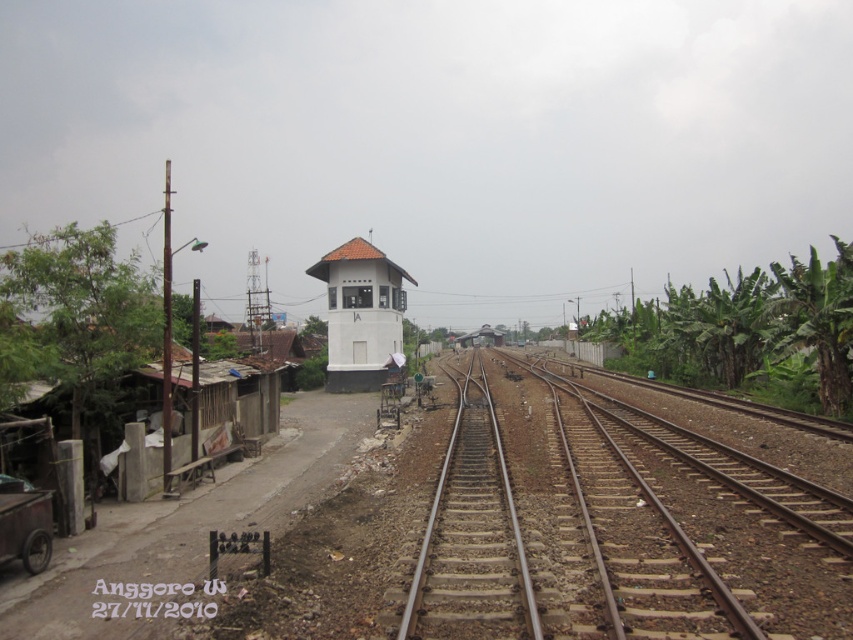
Question: From the image, what is the correct spatial relationship of white matte water tower at center in relation to metallic silver train at center?

Choices:
 (A) below
 (B) above

Answer: (B)

Question: Is brown metal train track at center closer to the viewer compared to white matte water tower at center?

Choices:
 (A) no
 (B) yes

Answer: (B)

Question: Estimate the real-world distances between objects in this image. Which object is farther from the white matte water tower at center?

Choices:
 (A) brown metal train track at center
 (B) metallic silver train at center

Answer: (B)

Question: Where is white matte water tower at center located in relation to metallic silver train at center in the image?

Choices:
 (A) right
 (B) left

Answer: (B)

Question: Which object is farther from the camera taking this photo?

Choices:
 (A) white matte water tower at center
 (B) metallic silver train at center

Answer: (B)

Question: Estimate the real-world distances between objects in this image. Which object is farther from the brown metal train track at center?

Choices:
 (A) metallic silver train at center
 (B) white matte water tower at center

Answer: (A)